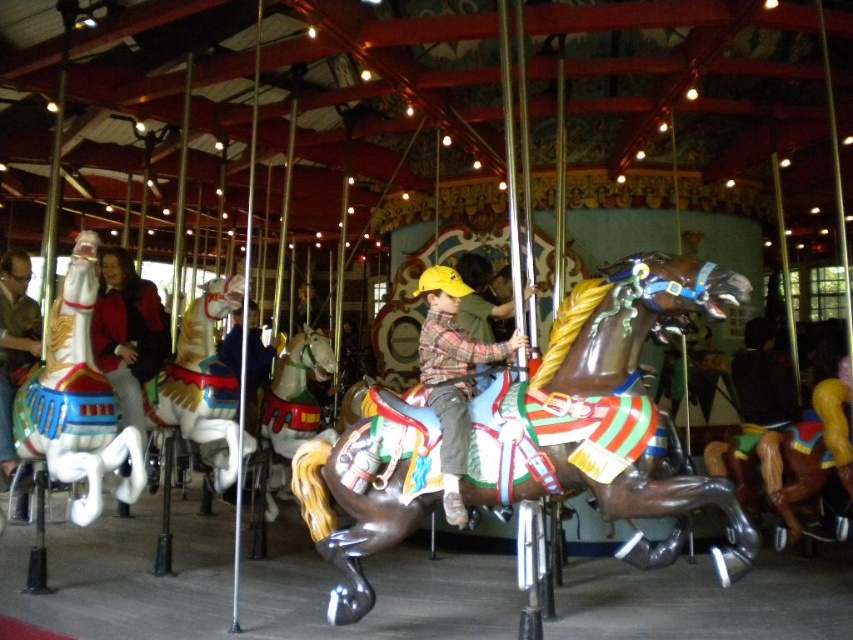
You are a photographer trying to capture a wide shot of the shiny brown horse at center and the matte black jacket at left. Based on their sizes, which object should you focus on first to ensure both are fully in frame?

The shiny brown horse at center is wider than the matte black jacket at left, so you should focus on the shiny brown horse at center first to ensure both fit in the frame.

You are a parent trying to decide which horse to choose for your child at the carousel. You see the white glossy horse at left and the brushed metal water at bottle left. Which one is taller?

The white glossy horse at left is much taller than the brushed metal water at bottle left.